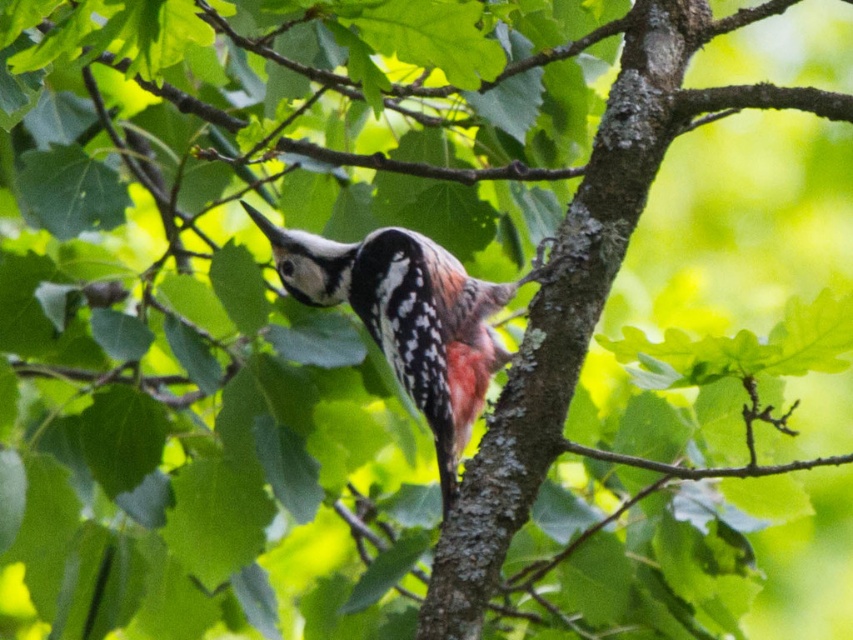
Between smooth bark tree trunk at center and white speckled woodpecker at center, which one is positioned higher?

white speckled woodpecker at center

Is point (520, 342) positioned before point (260, 216)?

No, it is behind (260, 216).

This screenshot has height=640, width=853. What do you see at coordinates (563, 314) in the screenshot?
I see `smooth bark tree trunk at center` at bounding box center [563, 314].

Where is `smooth bark tree trunk at center`? smooth bark tree trunk at center is located at coordinates (563, 314).